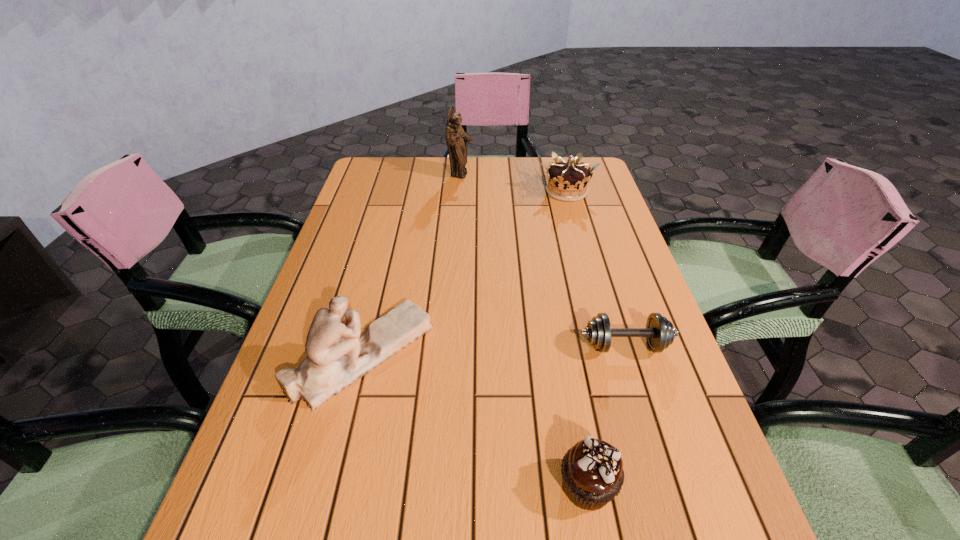
At what (x,y) coordinates should I click in order to perform the action: click on free space at the right edge of the desktop. Please return your answer as a coordinate pair (x, y). Looking at the image, I should click on (609, 296).

The height and width of the screenshot is (540, 960). Identify the location of vacant area at the far left corner of the desktop. (399, 176).

You are a GUI agent. You are given a task and a screenshot of the screen. Output one action in this format:
    pyautogui.click(x=<x>, y=<y>)
    Task: Click on the vacant space at the far right corner
    The image size is (960, 540).
    Given the screenshot: What is the action you would take?
    pyautogui.click(x=551, y=159)

The height and width of the screenshot is (540, 960). I want to click on unoccupied area between the third tallest object and the fourth shortest object, so click(465, 273).

Where is `free space between the shortest object and the tallest object`? This screenshot has height=540, width=960. free space between the shortest object and the tallest object is located at coordinates (543, 260).

Locate an element on the screen. The image size is (960, 540). vacant space that is in between the nearer figurine and the shortest object is located at coordinates (493, 350).

Image resolution: width=960 pixels, height=540 pixels. I want to click on vacant area between the taller figurine and the dumbbell, so click(x=543, y=260).

Where is `vacant space that's between the nearer figurine and the shortest object`? The width and height of the screenshot is (960, 540). vacant space that's between the nearer figurine and the shortest object is located at coordinates (493, 350).

The height and width of the screenshot is (540, 960). Find the location of `vacant area that lies between the second tallest object and the dumbbell`. vacant area that lies between the second tallest object and the dumbbell is located at coordinates (493, 350).

Identify the location of empty space between the shorter figurine and the dumbbell. This screenshot has width=960, height=540. (493, 350).